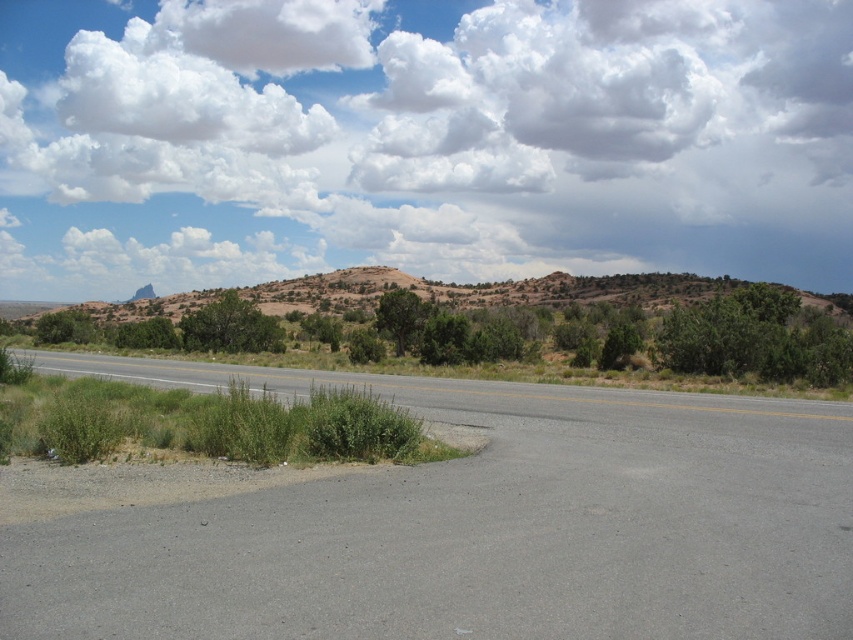
You are a drone operator trying to capture an image of the open road while ensuring the white fluffy cloud at upper center is centered in the frame. Given the cloud is at coordinates point 0.220, 0.494, what adjustment should you make to the camera position?

The white fluffy cloud at upper center is located at point [421,140], so you should adjust the camera position to center the frame on those coordinates to capture the cloud in the desired location.

You are a drone operator planning to fly your drone over the gray asphalt highway at center. You notice the white fluffy cloud at upper center in the image. Is there any object in the scene that might interfere with the drone flight path above the highway?

The white fluffy cloud at upper center is located above the gray asphalt highway at center, so it might interfere with the drone flight path above the highway.